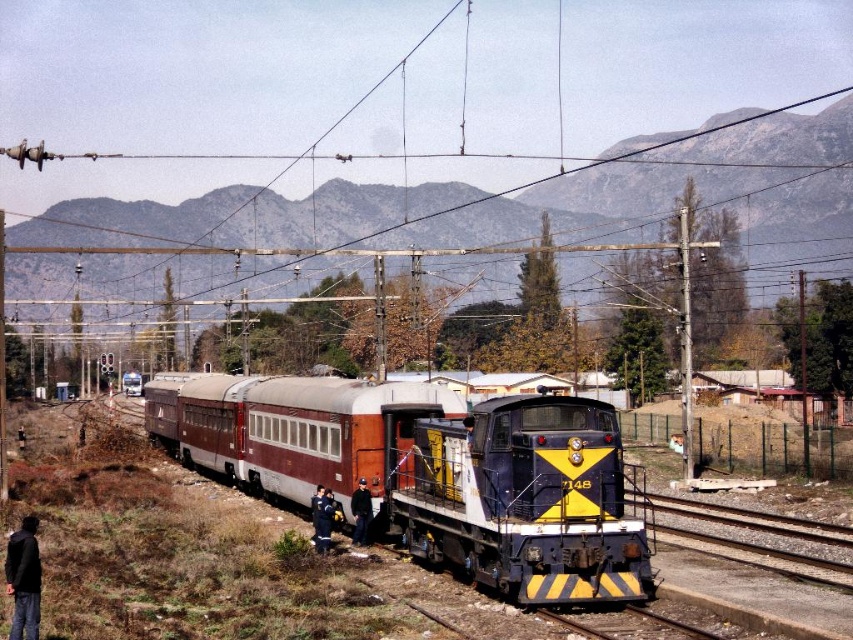
Question: Which point appears closest to the camera in this image?

Choices:
 (A) (318, 492)
 (B) (358, 520)
 (C) (563, 472)

Answer: (C)

Question: Among these points, which one is nearest to the camera?

Choices:
 (A) (332, 506)
 (B) (351, 509)

Answer: (A)

Question: Which object is positioned farthest from the black fabric jacket at center?

Choices:
 (A) yellow and blue locomotive at center
 (B) maroon painted car at center
 (C) blue uniform at center
 (D) black fabric jacket at lower left

Answer: (D)

Question: Is yellow and blue locomotive at center in front of gray gravel train track at lower center?

Choices:
 (A) yes
 (B) no

Answer: (A)

Question: Is maroon painted car at center below black fabric jacket at lower left?

Choices:
 (A) yes
 (B) no

Answer: (A)

Question: Does yellow and blue locomotive at center appear under gray gravel train track at lower center?

Choices:
 (A) no
 (B) yes

Answer: (A)